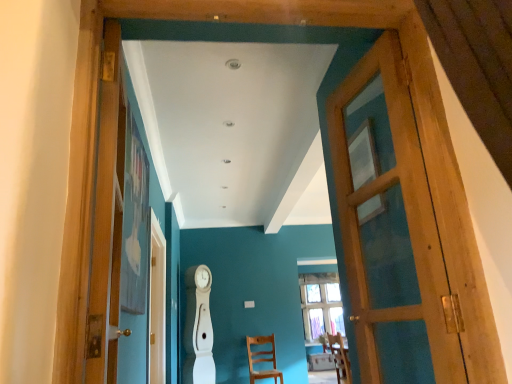
What do you see at coordinates (106, 217) in the screenshot?
I see `wooden door at left, marked as the 1th door in a left-to-right arrangement` at bounding box center [106, 217].

What is the approximate width of wooden chair at center, the second chair from the front?

It is 18.41 inches.

I want to click on wooden chair at center, positioned as the 1th chair in top-to-bottom order, so click(340, 358).

Locate an element on the screen. wooden door at right, acting as the second door starting from the left is located at coordinates (390, 228).

Considering the positions of objects wooden door at right, which is counted as the first door, starting from the right, and wooden door at left, marked as the 1th door in a left-to-right arrangement, in the image provided, who is in front, wooden door at right, which is counted as the first door, starting from the right, or wooden door at left, marked as the 1th door in a left-to-right arrangement,?

wooden door at left, marked as the 1th door in a left-to-right arrangement, is closer to the camera.

From the image's perspective, is wooden door at right, acting as the second door starting from the left, positioned above or below wooden door at left, marked as the 1th door in a left-to-right arrangement?

From the image's perspective, wooden door at right, acting as the second door starting from the left, appears below wooden door at left, marked as the 1th door in a left-to-right arrangement.

Is wooden door at right, which is counted as the first door, starting from the right, located outside wooden door at left, marked as the 1th door in a left-to-right arrangement?

wooden door at right, which is counted as the first door, starting from the right, is positioned outside wooden door at left, marked as the 1th door in a left-to-right arrangement.

Is wooden chair at center, marked as the second chair in a back-to-front arrangement, next to wooden chair at center, which is counted as the 1th chair, starting from the bottom?

No.

From a real-world perspective, which is physically above, wooden chair at center, positioned as the 1th chair in top-to-bottom order, or wooden chair at center, which is the second chair in right-to-left order?

wooden chair at center, positioned as the 1th chair in top-to-bottom order.

From the image's perspective, who appears lower, wooden chair at center, acting as the 2th chair starting from the bottom, or wooden chair at center, which is the second chair in right-to-left order?

wooden chair at center, which is the second chair in right-to-left order, is shown below in the image.

Looking at this image, could you tell me if wooden chair at center, acting as the 2th chair starting from the bottom, is facing wooden chair at center, the 2th chair viewed from the top?

No, wooden chair at center, acting as the 2th chair starting from the bottom, is not turned towards wooden chair at center, the 2th chair viewed from the top.

Is wooden chair at center, the 2th chair viewed from the top, far away from wooden door at right, acting as the second door starting from the left?

wooden chair at center, the 2th chair viewed from the top, is positioned a significant distance from wooden door at right, acting as the second door starting from the left.

From the image's perspective, is wooden chair at center, the first chair positioned from the back, located above wooden door at right, which is counted as the first door, starting from the right?

Actually, wooden chair at center, the first chair positioned from the back, appears below wooden door at right, which is counted as the first door, starting from the right, in the image.

From a real-world perspective, is wooden chair at center, which is the second chair in right-to-left order, on top of wooden door at right, which is counted as the first door, starting from the right?

No, from a real-world perspective, wooden chair at center, which is the second chair in right-to-left order, is not on top of wooden door at right, which is counted as the first door, starting from the right.

Locate an element on the screen. Image resolution: width=512 pixels, height=384 pixels. chair that is the 2nd one when counting downward from the wooden door at right, acting as the second door starting from the left (from the image's perspective) is located at coordinates (262, 359).

Does wooden chair at center, the first chair from the right, turn towards wooden door at left, the second door positioned from the right?

No, wooden chair at center, the first chair from the right, is not turned towards wooden door at left, the second door positioned from the right.

How distant is wooden chair at center, which appears as the first chair when viewed from the front, from wooden door at left, marked as the 1th door in a left-to-right arrangement?

3.73 meters.

Would you consider wooden chair at center, positioned as the 1th chair in top-to-bottom order, to be distant from wooden door at left, marked as the 1th door in a left-to-right arrangement?

Yes.

Based on the photo, is wooden chair at center, which is the second chair in right-to-left order, taller or shorter than wooden door at left, the second door positioned from the right?

Clearly, wooden chair at center, which is the second chair in right-to-left order, is shorter compared to wooden door at left, the second door positioned from the right.

In the image, is wooden chair at center, the 2th chair viewed from the top, on the left side or the right side of wooden door at left, marked as the 1th door in a left-to-right arrangement?

From the image, it's evident that wooden chair at center, the 2th chair viewed from the top, is to the right of wooden door at left, marked as the 1th door in a left-to-right arrangement.

Does wooden chair at center, the 1th chair in the left-to-right sequence, touch wooden door at left, marked as the 1th door in a left-to-right arrangement?

No, wooden chair at center, the 1th chair in the left-to-right sequence, is not in contact with wooden door at left, marked as the 1th door in a left-to-right arrangement.

From the image's perspective, which one is positioned higher, wooden chair at center, the first chair positioned from the back, or wooden door at left, marked as the 1th door in a left-to-right arrangement?

From the image's view, wooden door at left, marked as the 1th door in a left-to-right arrangement, is above.

How many degrees apart are the facing directions of wooden chair at center, acting as the 2th chair starting from the bottom, and wooden door at right, acting as the second door starting from the left?

There is a 171-degree angle between the facing directions of wooden chair at center, acting as the 2th chair starting from the bottom, and wooden door at right, acting as the second door starting from the left.

From a real-world perspective, who is located lower, wooden chair at center, which appears as the first chair when viewed from the front, or wooden door at right, acting as the second door starting from the left?

From a 3D spatial view, wooden chair at center, which appears as the first chair when viewed from the front, is below.

Which is behind, point (343, 346) or point (423, 214)?

Positioned behind is point (343, 346).

Can you see wooden chair at center, the first chair from the right, touching wooden door at right, acting as the second door starting from the left?

No, wooden chair at center, the first chair from the right, is not next to wooden door at right, acting as the second door starting from the left.

Is wooden chair at center, the first chair positioned from the back, further to the viewer compared to wooden chair at center, which appears as the first chair when viewed from the front?

Yes.

Is wooden chair at center, the first chair positioned from the back, placed right next to wooden chair at center, which appears as the first chair when viewed from the front?

No, wooden chair at center, the first chair positioned from the back, is not with wooden chair at center, which appears as the first chair when viewed from the front.

Can you confirm if wooden chair at center, which is the second chair in right-to-left order, is bigger than wooden chair at center, arranged as the second chair when viewed from the left?

Correct, wooden chair at center, which is the second chair in right-to-left order, is larger in size than wooden chair at center, arranged as the second chair when viewed from the left.

I want to click on door that appears on the right of wooden door at left, the second door positioned from the right, so click(x=390, y=228).

The width and height of the screenshot is (512, 384). Identify the location of chair that is below the wooden chair at center, positioned as the 1th chair in top-to-bottom order (from the image's perspective). (262, 359).

Which object lies nearer to the anchor point wooden chair at center, which appears as the first chair when viewed from the front, wooden door at left, the second door positioned from the right, or wooden door at right, which is counted as the first door, starting from the right?

wooden door at right, which is counted as the first door, starting from the right, is closer to wooden chair at center, which appears as the first chair when viewed from the front.

Estimate the real-world distances between objects in this image. Which object is further from wooden chair at center, arranged as the second chair when viewed from the left, wooden chair at center, the second chair from the front, or wooden door at right, acting as the second door starting from the left?

Based on the image, wooden door at right, acting as the second door starting from the left, appears to be further to wooden chair at center, arranged as the second chair when viewed from the left.

Estimate the real-world distances between objects in this image. Which object is further from wooden door at left, marked as the 1th door in a left-to-right arrangement, wooden chair at center, which appears as the first chair when viewed from the front, or wooden door at right, which is counted as the first door, starting from the right?

Based on the image, wooden chair at center, which appears as the first chair when viewed from the front, appears to be further to wooden door at left, marked as the 1th door in a left-to-right arrangement.

Which object lies further to the anchor point wooden door at left, marked as the 1th door in a left-to-right arrangement, wooden door at right, acting as the second door starting from the left, or wooden chair at center, marked as the second chair in a back-to-front arrangement?

wooden chair at center, marked as the second chair in a back-to-front arrangement, is further to wooden door at left, marked as the 1th door in a left-to-right arrangement.

Consider the image. When comparing their distances from wooden chair at center, positioned as the 1th chair in top-to-bottom order, does wooden door at right, acting as the second door starting from the left, or wooden door at left, marked as the 1th door in a left-to-right arrangement, seem further?

Among the two, wooden door at left, marked as the 1th door in a left-to-right arrangement, is located further to wooden chair at center, positioned as the 1th chair in top-to-bottom order.

Considering their positions, is wooden chair at center, which is the second chair in right-to-left order, positioned closer to wooden door at right, acting as the second door starting from the left, than wooden door at left, the second door positioned from the right?

wooden door at left, the second door positioned from the right, lies closer to wooden door at right, acting as the second door starting from the left, than the other object.

Considering their positions, is wooden chair at center, acting as the 2th chair starting from the bottom, positioned further to wooden chair at center, which is the second chair in right-to-left order, than wooden door at left, the second door positioned from the right?

Among the two, wooden door at left, the second door positioned from the right, is located further to wooden chair at center, which is the second chair in right-to-left order.

Based on their spatial positions, is wooden chair at center, marked as the second chair in a back-to-front arrangement, or wooden chair at center, the first chair positioned from the back, further from wooden door at left, the second door positioned from the right?

wooden chair at center, the first chair positioned from the back, lies further to wooden door at left, the second door positioned from the right, than the other object.

Identify the location of door positioned between wooden door at left, the second door positioned from the right, and wooden chair at center, the first chair positioned from the back, from near to far. (390, 228).

In order to click on door between wooden door at left, marked as the 1th door in a left-to-right arrangement, and wooden chair at center, acting as the 2th chair starting from the bottom, along the z-axis in this screenshot , I will do `click(390, 228)`.

You are a GUI agent. You are given a task and a screenshot of the screen. Output one action in this format:
    pyautogui.click(x=<x>, y=<y>)
    Task: Click on the chair between wooden door at left, the second door positioned from the right, and wooden chair at center, which is the second chair in right-to-left order, along the z-axis
    The width and height of the screenshot is (512, 384).
    Given the screenshot: What is the action you would take?
    pyautogui.click(x=340, y=358)

This screenshot has width=512, height=384. Identify the location of chair between wooden door at right, acting as the second door starting from the left, and wooden chair at center, the first chair positioned from the back, from front to back. (340, 358).